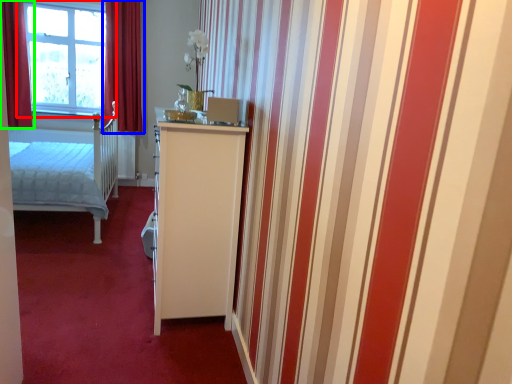
Question: Considering the real-world distances, which object is closest to window (highlighted by a red box)? curtain (highlighted by a blue box) or curtain (highlighted by a green box).

Choices:
 (A) curtain
 (B) curtain

Answer: (A)